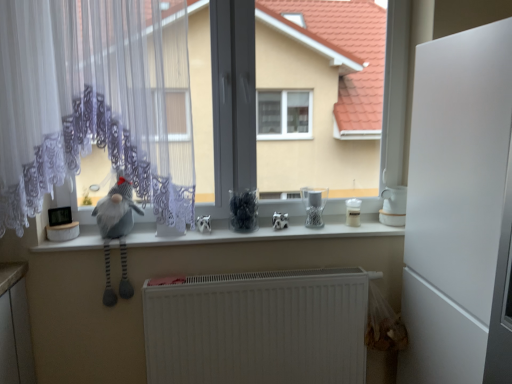
Where is `free spot to the right of white plastic container at center, which is the 2th appliance in left-to-right order`? Image resolution: width=512 pixels, height=384 pixels. free spot to the right of white plastic container at center, which is the 2th appliance in left-to-right order is located at coordinates (376, 225).